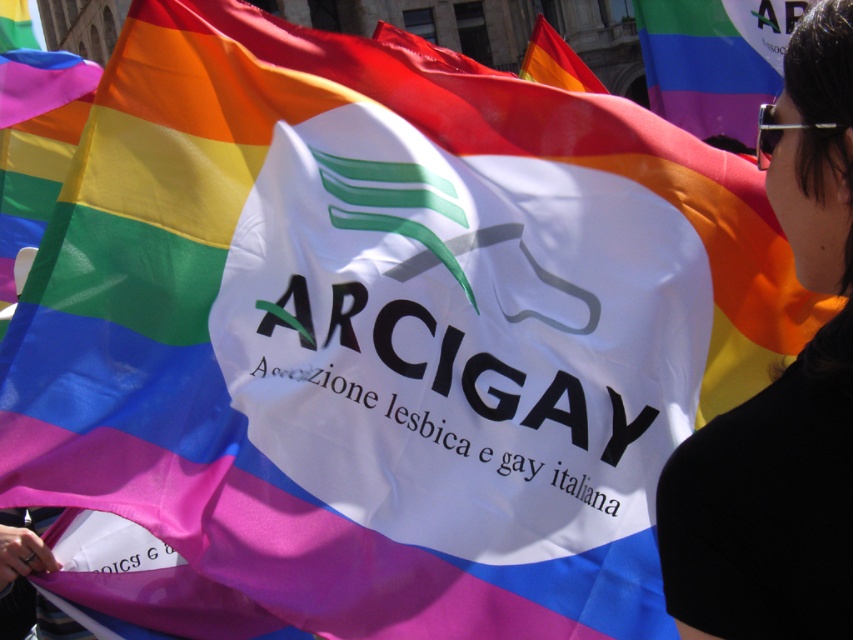
From the picture: Is black fabric at upper right below rainbow fabric flag at upper center?

Correct, black fabric at upper right is located below rainbow fabric flag at upper center.

Is black fabric at upper right shorter than rainbow fabric flag at upper center?

Yes, black fabric at upper right is shorter than rainbow fabric flag at upper center.

Identify the location of black fabric at upper right. (781, 396).

The height and width of the screenshot is (640, 853). What are the coordinates of `black fabric at upper right` in the screenshot? It's located at (781, 396).